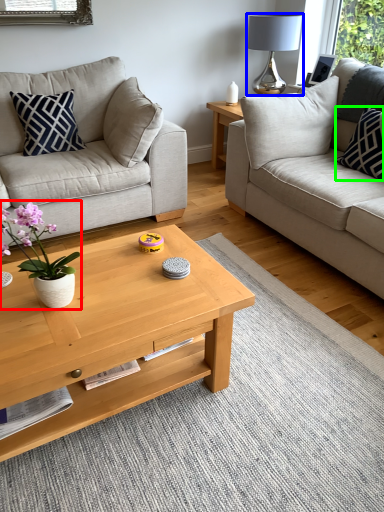
Question: Which is farther away from houseplant (highlighted by a red box)? lamp (highlighted by a blue box) or pillow (highlighted by a green box)?

Choices:
 (A) lamp
 (B) pillow

Answer: (A)